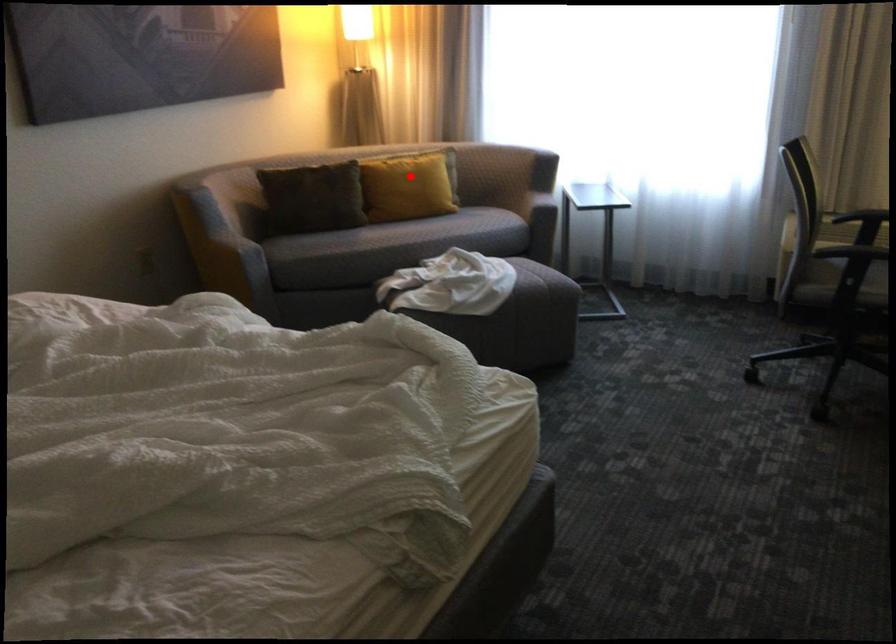
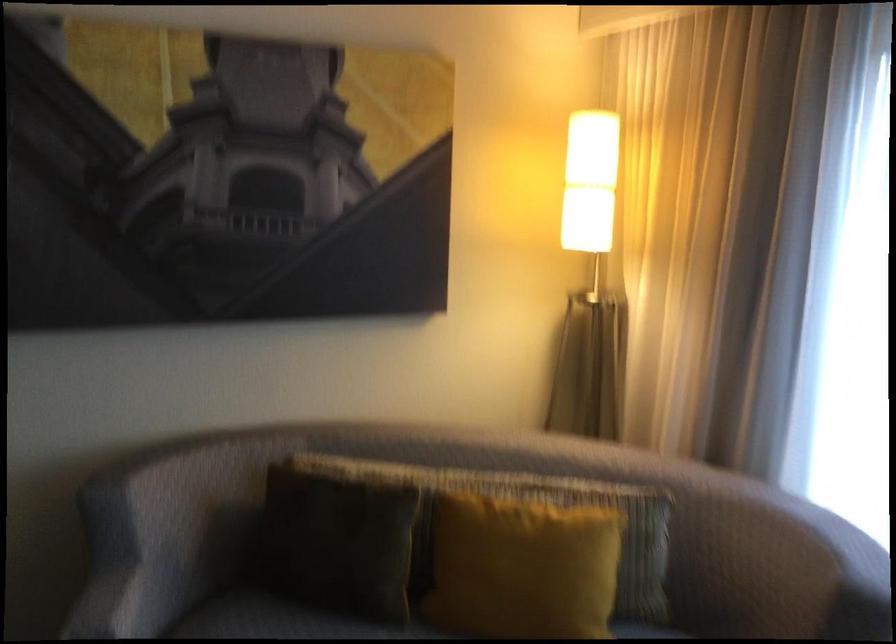
Question: I am providing you with two images of the same scene from different viewpoints. In image1, a red point is highlighted. Considering the same 3D point in image2, which of the following is correct?

Choices:
 (A) It is closer
 (B) It is farther

Answer: (A)